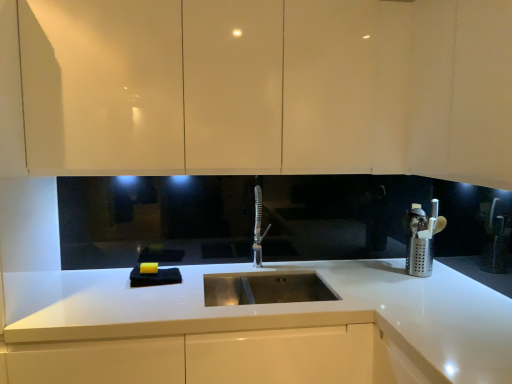
Question: Is white glossy countertop at center in front of or behind satin nickel faucet at center in the image?

Choices:
 (A) behind
 (B) front

Answer: (B)

Question: From a real-world perspective, is white glossy countertop at center positioned above or below satin nickel faucet at center?

Choices:
 (A) below
 (B) above

Answer: (A)

Question: Which object is the farthest from the white glossy countertop at center?

Choices:
 (A) matte white cabinets at upper center
 (B) silver perforated utensil holder at right
 (C) satin nickel faucet at center

Answer: (A)

Question: Estimate the real-world distances between objects in this image. Which object is closer to the white glossy countertop at center?

Choices:
 (A) matte white cabinets at upper center
 (B) silver perforated utensil holder at right
 (C) satin nickel faucet at center

Answer: (B)